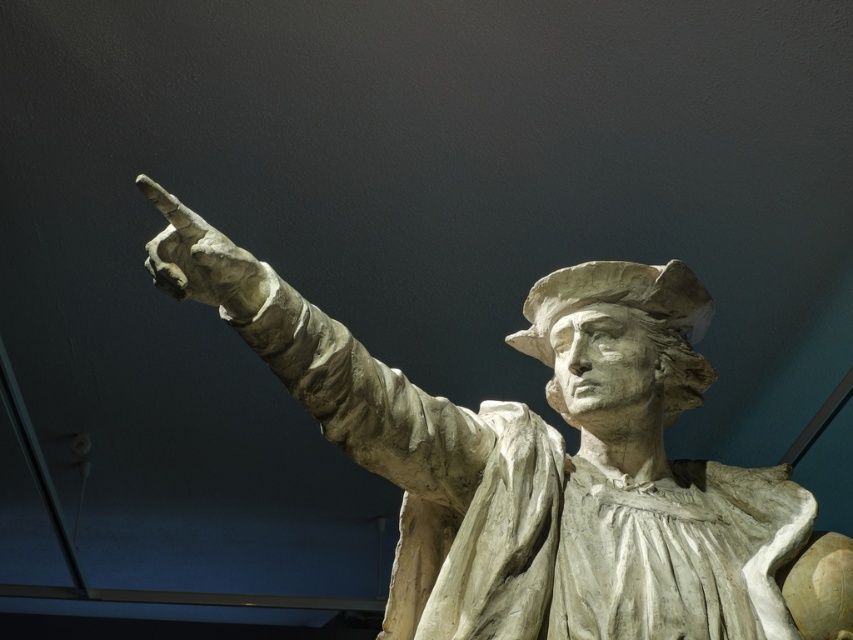
Looking at this image, you are an art conservator examining the sculpture. You notice the white stone hand at upper left and the white stone statue at center. Which object would require more material to create due to its size?

The white stone statue at center requires more material because it is larger in size than the white stone hand at upper left.

You are an art conservator assessing the dimensions of the white stone statue at center and the white stone hand at upper left. Which object has a greater width?

The white stone statue at center has a greater width than the white stone hand at upper left.